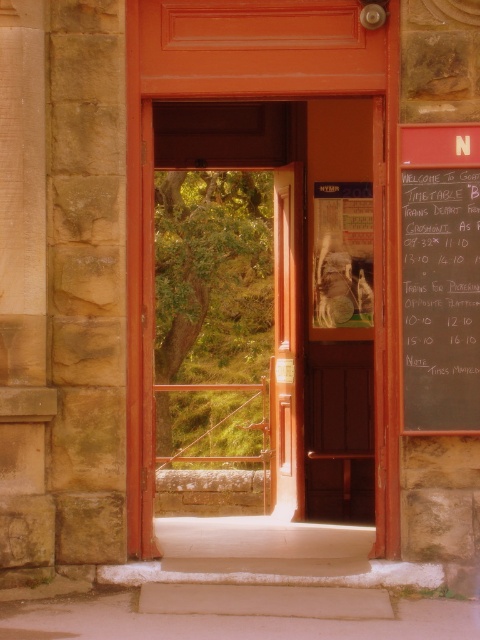
Does wooden door at center have a larger size compared to black chalkboard at right?

Yes.

Which is more to the left, wooden door at center or black chalkboard at right?

Positioned to the left is wooden door at center.

Find the location of a particular element. Image resolution: width=480 pixels, height=640 pixels. wooden door at center is located at coordinates (268, 300).

Find the location of a particular element. The image size is (480, 640). wooden door at center is located at coordinates (268, 300).